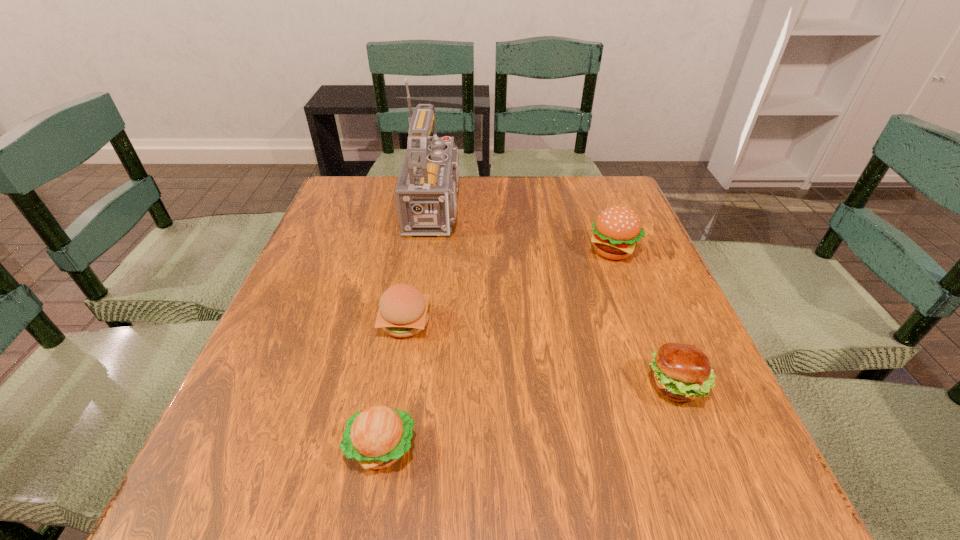
Locate an element on the screen. The height and width of the screenshot is (540, 960). empty space between the tallest object and the third nearest hamburger is located at coordinates (423, 264).

Where is `free point between the third farthest hamburger and the nearest object`? This screenshot has width=960, height=540. free point between the third farthest hamburger and the nearest object is located at coordinates (529, 416).

Where is `unoccupied position between the second nearest hamburger and the tallest object`? The height and width of the screenshot is (540, 960). unoccupied position between the second nearest hamburger and the tallest object is located at coordinates (559, 295).

Find the location of a particular element. The image size is (960, 540). unoccupied position between the nearest object and the second nearest hamburger is located at coordinates (529, 416).

At what (x,y) coordinates should I click in order to perform the action: click on vacant area that lies between the fourth shortest object and the second farthest hamburger. Please return your answer as a coordinate pair (x, y). This screenshot has width=960, height=540. Looking at the image, I should click on (509, 286).

Where is `vacant space that is in between the farthest hamburger and the radio receiver`? vacant space that is in between the farthest hamburger and the radio receiver is located at coordinates (527, 228).

The height and width of the screenshot is (540, 960). Find the location of `free space between the second tallest object and the tallest object`. free space between the second tallest object and the tallest object is located at coordinates (527, 228).

The image size is (960, 540). In order to click on vacant point located between the fourth shortest object and the radio receiver in this screenshot , I will do `click(527, 228)`.

Locate an element on the screen. free space between the third farthest object and the third farthest hamburger is located at coordinates (540, 354).

Locate which object ranks third in proximity to the third farthest hamburger. Please provide its 2D coordinates. Your answer should be formatted as a tuple, i.e. [(x, y)], where the tuple contains the x and y coordinates of a point satisfying the conditions above.

[(403, 310)]